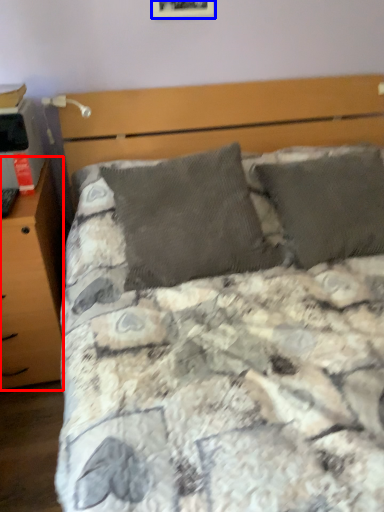
Question: Among these objects, which one is farthest to the camera, nightstand (highlighted by a red box) or picture frame (highlighted by a blue box)?

Choices:
 (A) nightstand
 (B) picture frame

Answer: (B)